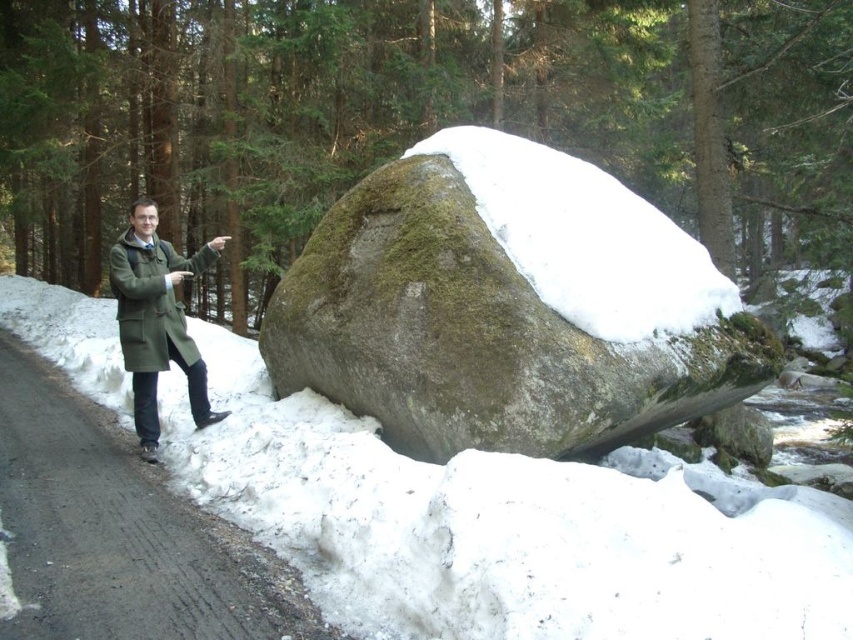
Question: Considering the real-world distances, which object is closest to the green mossy rock at center?

Choices:
 (A) green wool coat at left
 (B) white fluffy snow at center

Answer: (B)

Question: Where is white fluffy snow at center located in relation to green mossy rock at center in the image?

Choices:
 (A) above
 (B) below

Answer: (B)

Question: From the image, what is the correct spatial relationship of white fluffy snow at center in relation to green wool coat at left?

Choices:
 (A) left
 (B) right

Answer: (A)

Question: Which object appears closest to the camera in this image?

Choices:
 (A) white fluffy snow at center
 (B) green wool coat at left

Answer: (A)

Question: Can you confirm if green mossy rock at center is smaller than green wool coat at left?

Choices:
 (A) no
 (B) yes

Answer: (A)

Question: Among these points, which one is farthest from the camera?

Choices:
 (A) (711, 323)
 (B) (119, 314)

Answer: (B)